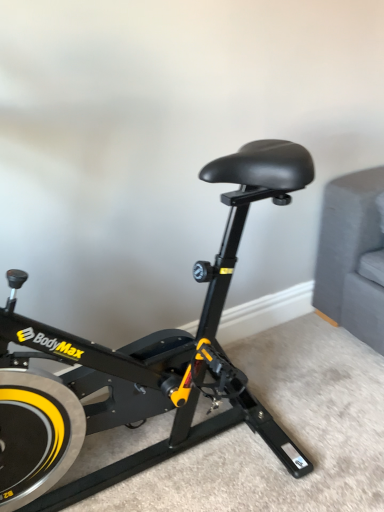
Question: Should I look upward or downward to see black matte stationary bicycle at center?

Choices:
 (A) down
 (B) up

Answer: (A)